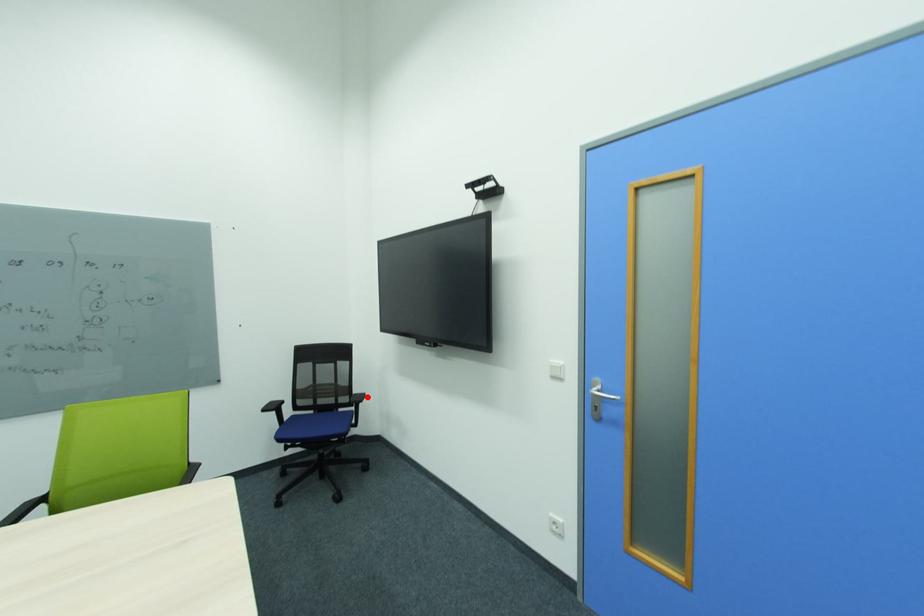
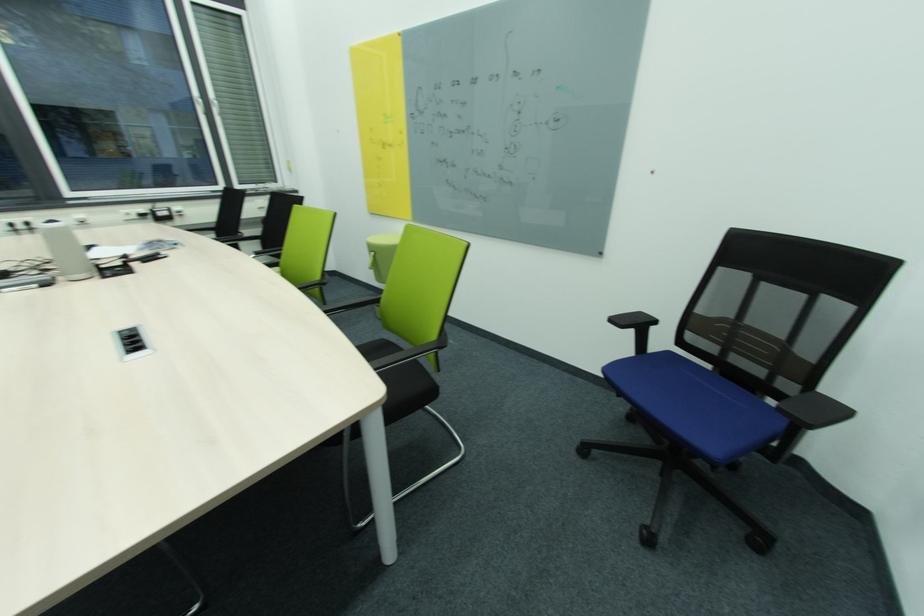
Find the pixel in the second image that matches the highlighted location in the first image.

(845, 411)